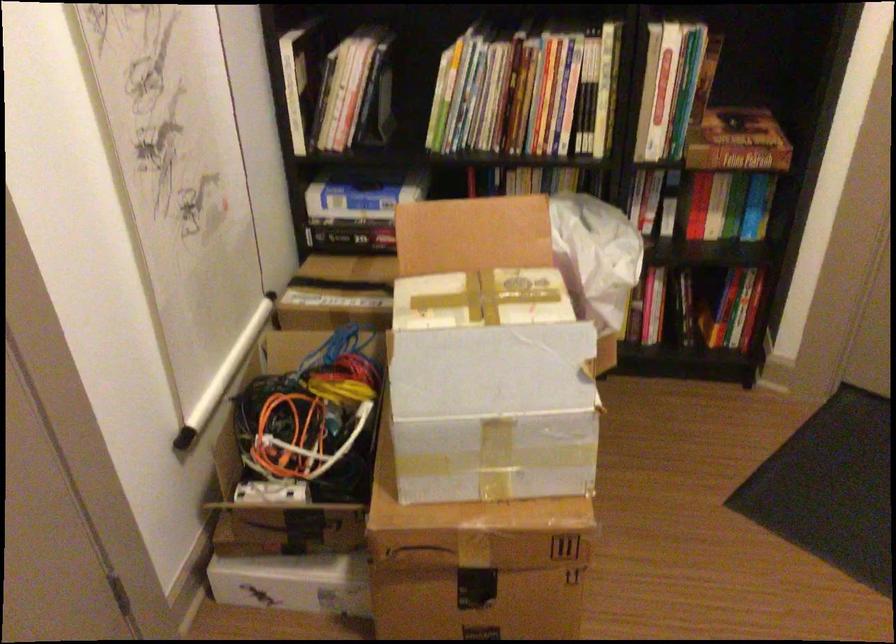
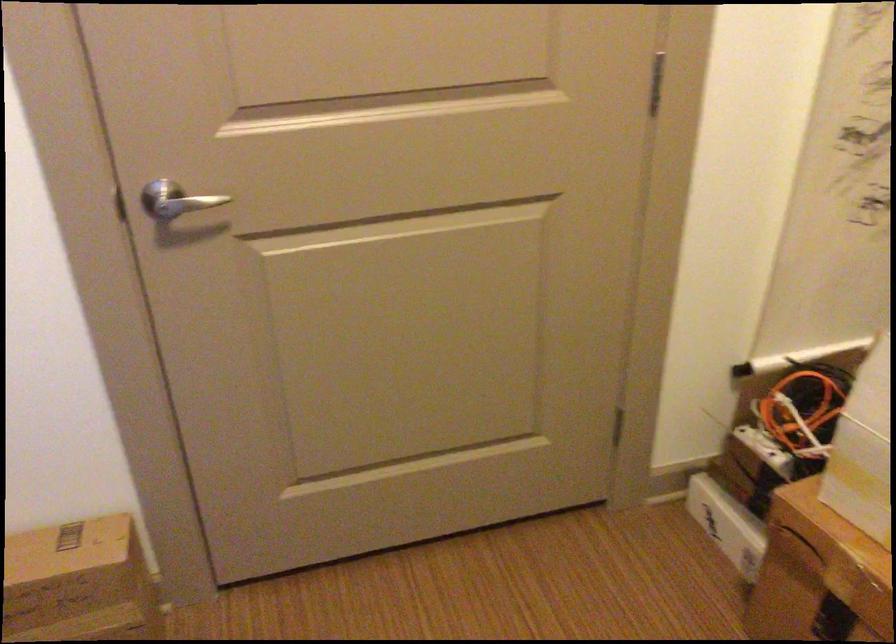
In the second image, find the point that corresponds to (x=411, y=437) in the first image.

(864, 450)